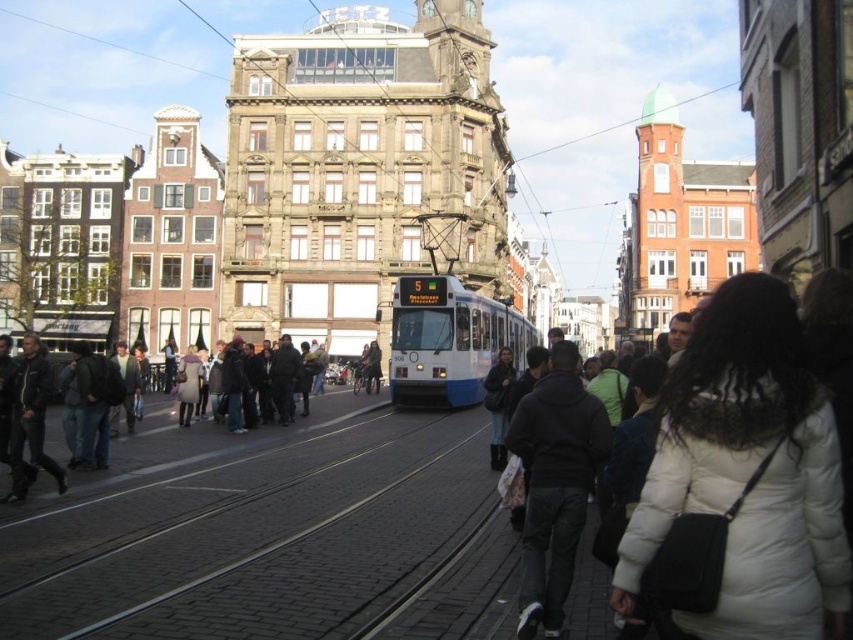
Based on the photo, does white puffy coat at lower right appear under white glossy tram at center?

Indeed, white puffy coat at lower right is positioned under white glossy tram at center.

Between point (836, 602) and point (512, 346), which one is positioned behind?

The point (512, 346) is behind.

Locate an element on the screen. The width and height of the screenshot is (853, 640). white puffy coat at lower right is located at coordinates (747, 472).

Which of these two, white glossy tram at center or dark gray fabric crowd at center left, stands taller?

Standing taller between the two is white glossy tram at center.

Is point (445, 314) more distant than point (250, 419)?

Yes, it is behind point (250, 419).

Does point (454, 317) come closer to viewer compared to point (287, 355)?

Yes, point (454, 317) is in front of point (287, 355).

This screenshot has height=640, width=853. Find the location of `white glossy tram at center`. white glossy tram at center is located at coordinates (448, 340).

Between point (419, 369) and point (497, 413), which one is positioned behind?

Positioned behind is point (419, 369).

Is white glossy tram at center above dark blue jacket at center?

Yes, white glossy tram at center is above dark blue jacket at center.

Where is `white glossy tram at center`? white glossy tram at center is located at coordinates (448, 340).